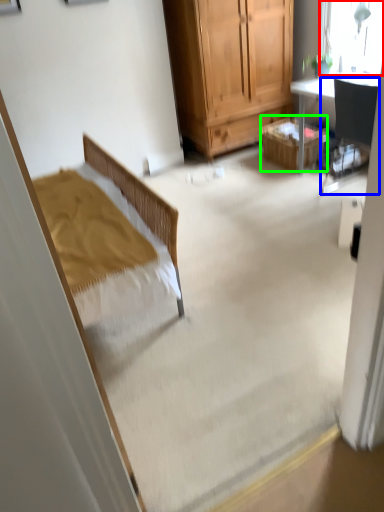
Question: Estimate the real-world distances between objects in this image. Which object is farther from window (highlighted by a red box), chair (highlighted by a blue box) or picnic basket (highlighted by a green box)?

Choices:
 (A) chair
 (B) picnic basket

Answer: (B)